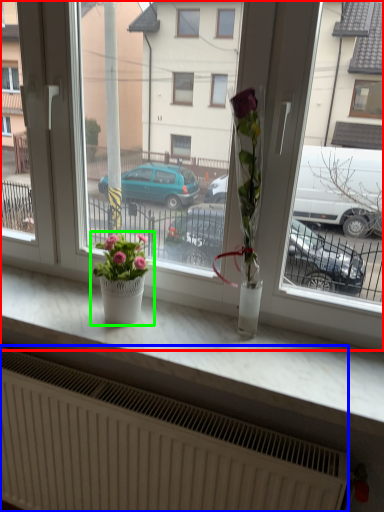
Question: Which object is positioned farthest from window (highlighted by a red box)? Select from radiator (highlighted by a blue box) and houseplant (highlighted by a green box).

Choices:
 (A) radiator
 (B) houseplant

Answer: (A)